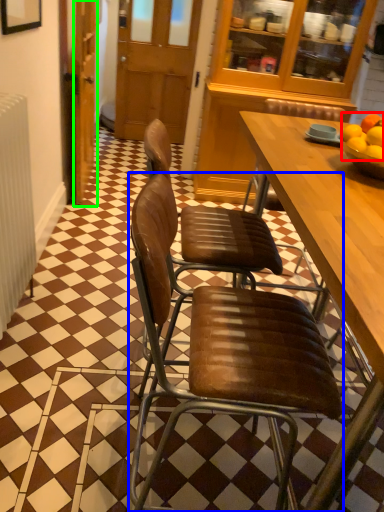
Question: Which object is the farthest from fruit (highlighted by a red box)? Choose among these: chair (highlighted by a blue box) or door (highlighted by a green box).

Choices:
 (A) chair
 (B) door

Answer: (B)